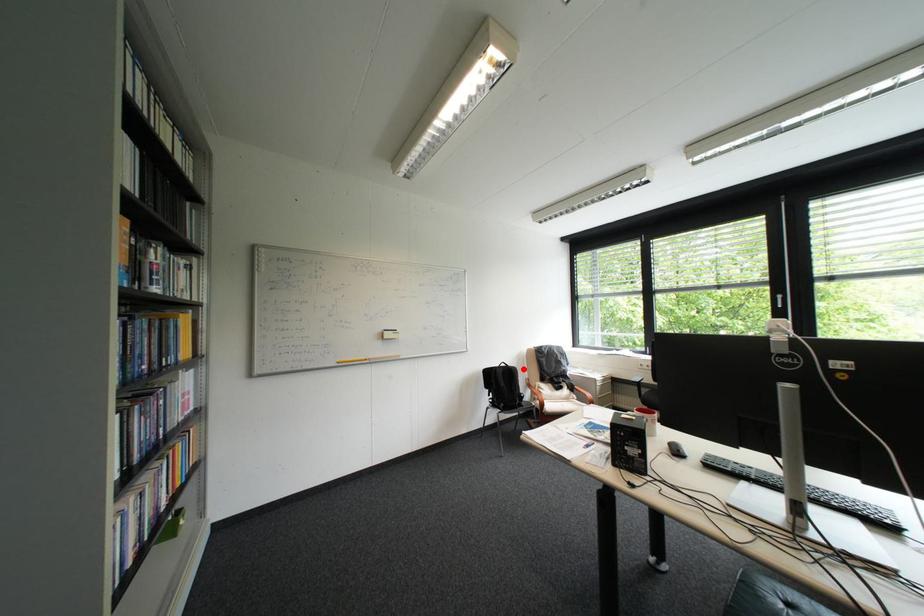
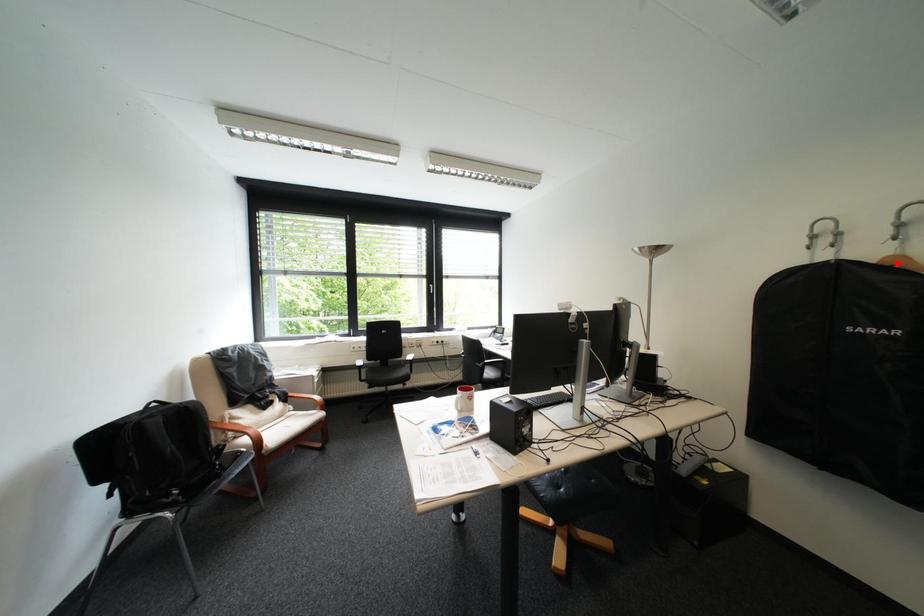
I am providing you with two images of the same scene from different viewpoints. A red point is marked on the first image and another point is marked on the second image. Are the points marked in image1 and image2 representing the same 3D position?

No